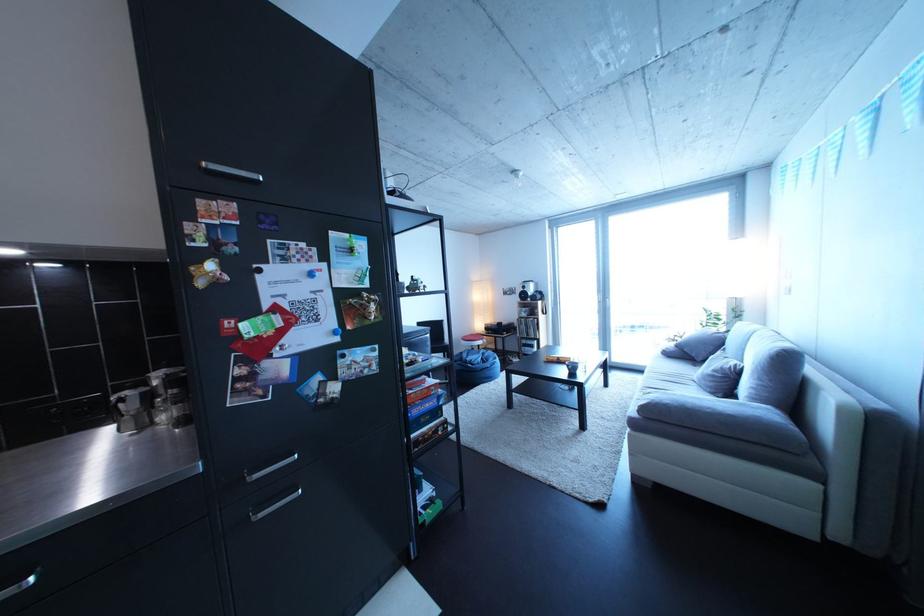
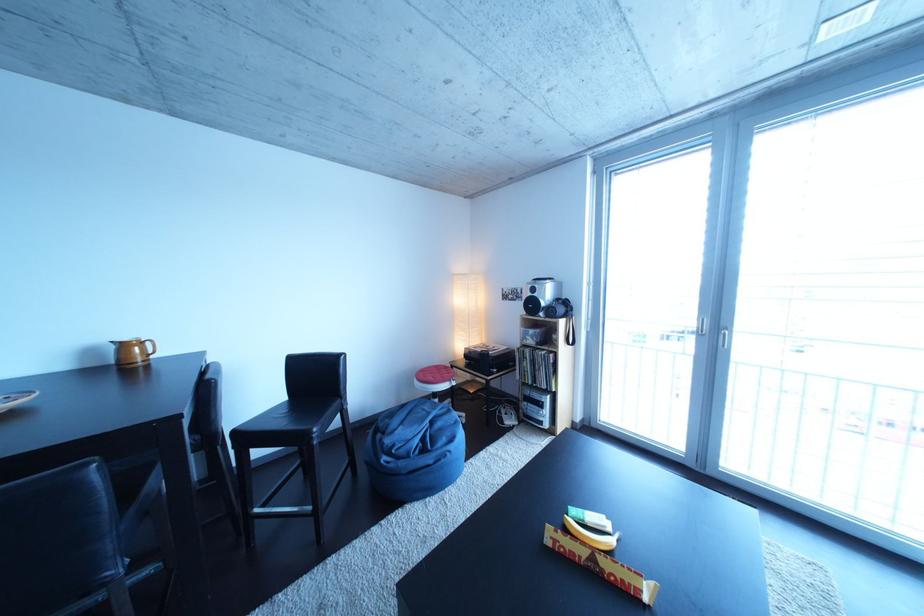
Find the pixel in the second image that matches (x=495, y=360) in the first image.

(444, 428)